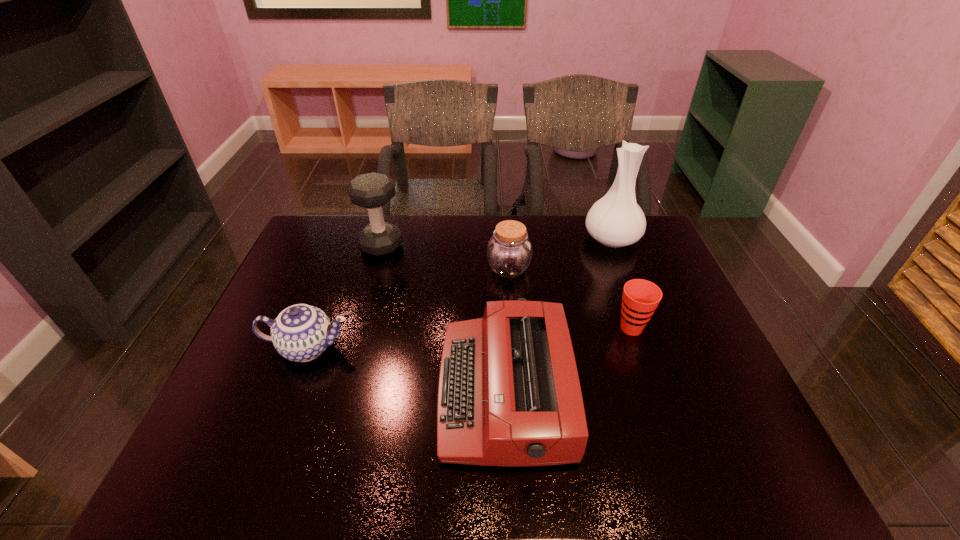
Find the location of a particular element. The height and width of the screenshot is (540, 960). free point located on the front of the cup is located at coordinates (644, 366).

You are a GUI agent. You are given a task and a screenshot of the screen. Output one action in this format:
    pyautogui.click(x=<x>, y=<y>)
    Task: Click on the vacant space located 0.140m on the typing side of the typewriter
    
    Given the screenshot: What is the action you would take?
    [x=380, y=392]

Locate an element on the screen. vacant area situated 0.250m on the typing side of the typewriter is located at coordinates (334, 392).

This screenshot has width=960, height=540. Identify the location of vacant space located 0.190m on the typing side of the typewriter. (359, 392).

You are a GUI agent. You are given a task and a screenshot of the screen. Output one action in this format:
    pyautogui.click(x=<x>, y=<y>)
    Task: Click on the vase that is positioned at the far edge
    
    Given the screenshot: What is the action you would take?
    pyautogui.click(x=616, y=220)

Identify the location of dumbbell that is at the far edge. (373, 190).

I want to click on jar located at the far edge, so click(509, 252).

Image resolution: width=960 pixels, height=540 pixels. I want to click on object at the near edge, so click(x=509, y=394).

Locate an element on the screen. This screenshot has width=960, height=540. object situated at the left edge is located at coordinates (301, 332).

The width and height of the screenshot is (960, 540). Identify the location of vase at the right edge. (616, 220).